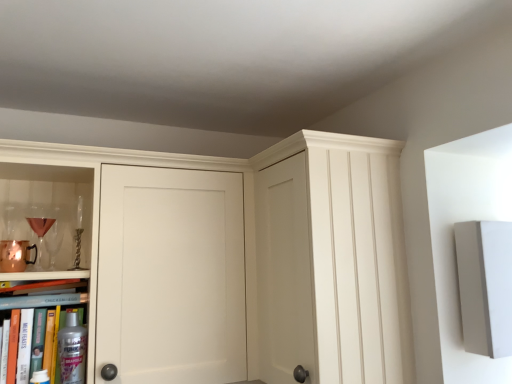
Question: From the image's perspective, relative to satin silver spray at lower left, is clear glass wine glass at left, which appears as the 1th wine glass when viewed from the back, above or below?

Choices:
 (A) below
 (B) above

Answer: (B)

Question: Relative to satin silver spray at lower left, is clear glass wine glass at left, which appears as the 1th wine glass when viewed from the back, in front or behind?

Choices:
 (A) front
 (B) behind

Answer: (B)

Question: Based on their relative distances, which object is farther from the metallic silver spray can at lower left, positioned as the 2th book in top-to-bottom order?

Choices:
 (A) matte gold wine glass at left, arranged as the second wine glass when viewed from the back
 (B) satin silver spray at lower left
 (C) hardcover book at lower left, the first book from the top
 (D) clear glass wine glass at left, which is counted as the 2th wine glass, starting from the front
 (E) transparent glass cabinet at center

Answer: (E)

Question: Considering the real-world distances, which object is closest to the transparent glass cabinet at center?

Choices:
 (A) hardcover book at lower left, the first book from the top
 (B) satin silver spray at lower left
 (C) metallic silver spray can at lower left, acting as the first book starting from the bottom
 (D) matte gold wine glass at left, arranged as the second wine glass when viewed from the back
 (E) clear glass wine glass at left, which is counted as the 2th wine glass, starting from the front

Answer: (C)